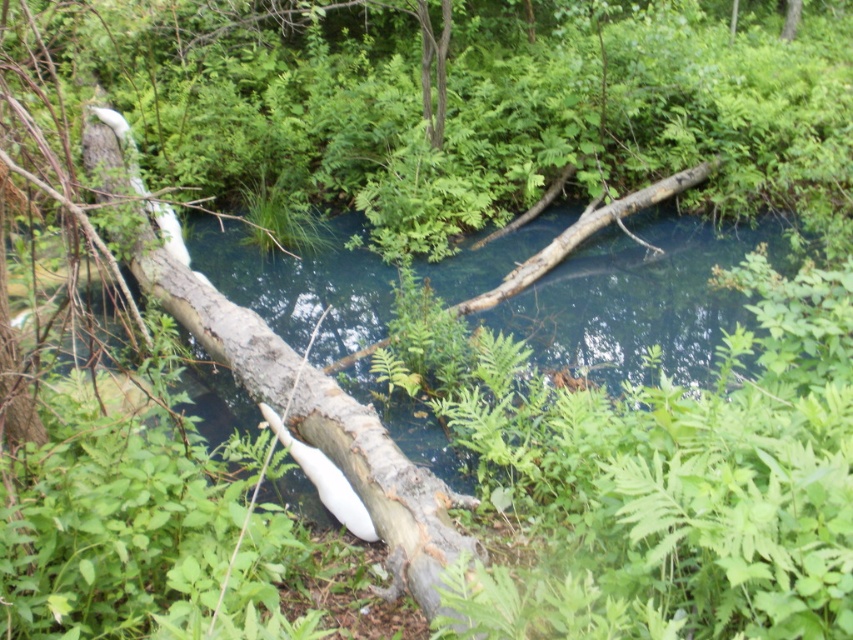
Question: Which point is farther to the camera?

Choices:
 (A) smooth gray log at center
 (B) clear water at center

Answer: (B)

Question: Which point appears farthest from the camera in this image?

Choices:
 (A) (163, 262)
 (B) (700, 385)

Answer: (A)

Question: Is clear water at center bigger than smooth gray log at center?

Choices:
 (A) yes
 (B) no

Answer: (B)

Question: Can you confirm if clear water at center is thinner than smooth gray log at center?

Choices:
 (A) yes
 (B) no

Answer: (B)

Question: In this image, where is clear water at center located relative to smooth gray log at center?

Choices:
 (A) above
 (B) below

Answer: (A)